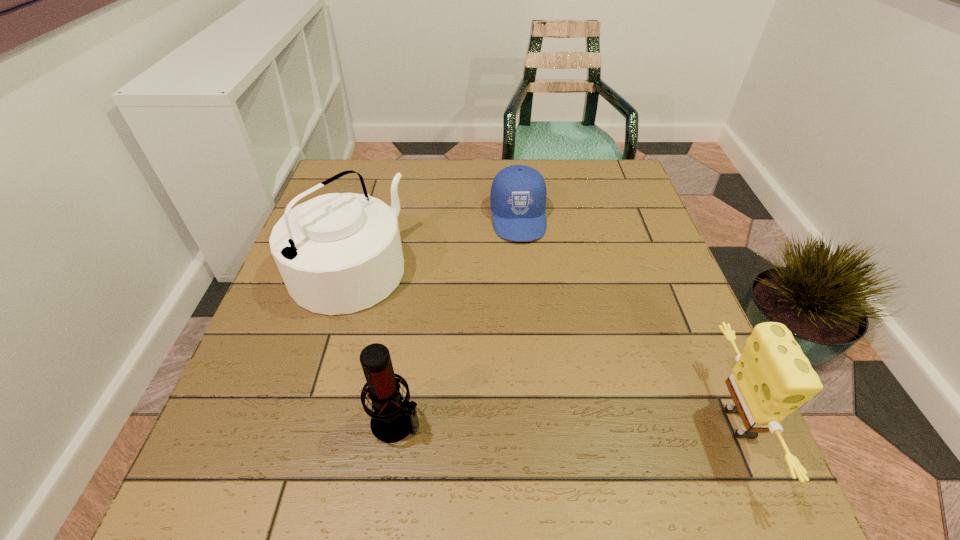
You are a GUI agent. You are given a task and a screenshot of the screen. Output one action in this format:
    pyautogui.click(x=<x>, y=<y>)
    Task: Click on the free space at the left edge of the desktop
    This screenshot has height=540, width=960.
    Given the screenshot: What is the action you would take?
    pyautogui.click(x=276, y=394)

Find the location of a particular element. This screenshot has width=960, height=540. free location at the right edge of the desktop is located at coordinates (630, 247).

Identify the location of free region at the far left corner of the desktop. (360, 183).

At what (x,y) coordinates should I click in order to perform the action: click on vacant space at the near left corner of the desktop. Please return your answer as a coordinate pair (x, y). The width and height of the screenshot is (960, 540). Looking at the image, I should click on (224, 409).

I want to click on vacant space at the far right corner, so click(593, 196).

Find the location of a particular element. The image size is (960, 540). vacant space at the near right corner of the desktop is located at coordinates (666, 420).

Find the location of a particular element. This screenshot has height=540, width=960. blank region between the rightmost object and the kettle is located at coordinates (544, 346).

Find the location of a particular element. The width and height of the screenshot is (960, 540). vacant region between the sponge and the kettle is located at coordinates (544, 346).

The height and width of the screenshot is (540, 960). Find the location of `free spot between the rightmost object and the microphone`. free spot between the rightmost object and the microphone is located at coordinates (569, 422).

Find the location of a particular element. This screenshot has height=540, width=960. free space between the kettle and the sponge is located at coordinates (544, 346).